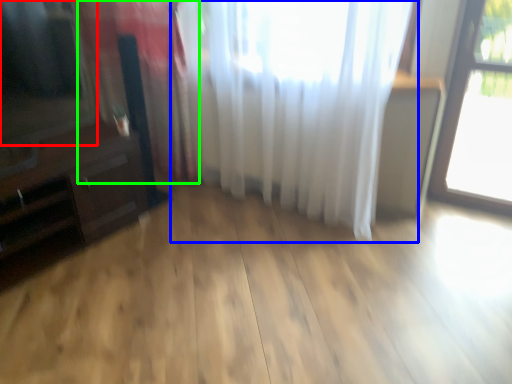
Question: Which object is the closest to the window screen (highlighted by a red box)? Choose among these: curtain (highlighted by a blue box) or curtain (highlighted by a green box).

Choices:
 (A) curtain
 (B) curtain

Answer: (B)